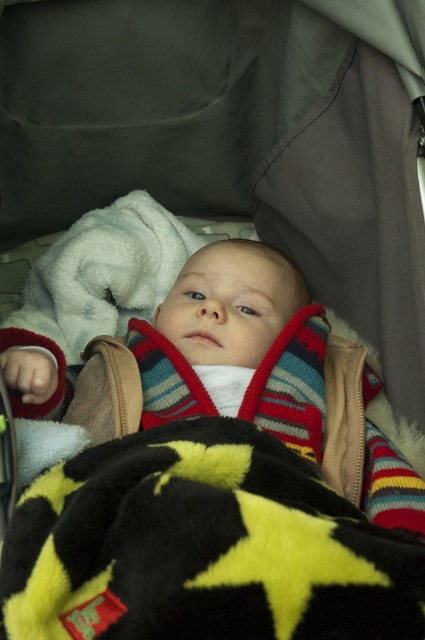
Is fluffy black blanket with yellow stars at center shorter than striped knit sweater at center?

Indeed, fluffy black blanket with yellow stars at center has a lesser height compared to striped knit sweater at center.

Is fluffy black blanket with yellow stars at center to the right of striped knit sweater at center from the viewer's perspective?

No, fluffy black blanket with yellow stars at center is not to the right of striped knit sweater at center.

Is point (82, 492) more distant than point (243, 387)?

No.

Identify the location of fluffy black blanket with yellow stars at center. This screenshot has width=425, height=640. (201, 547).